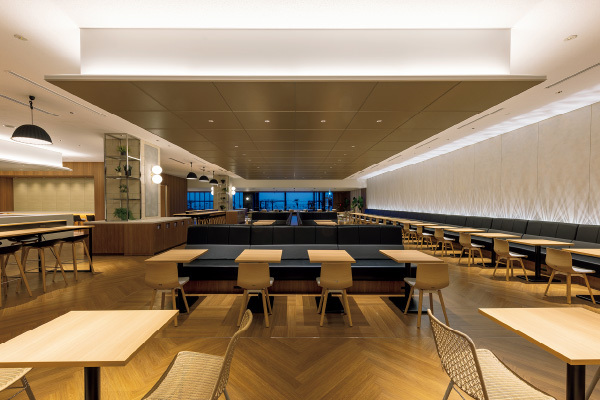
Find the location of a particular element. The height and width of the screenshot is (400, 600). chairs is located at coordinates (209, 280), (286, 276), (385, 273), (455, 358), (562, 272), (501, 247), (465, 239), (439, 236), (418, 231), (406, 229).